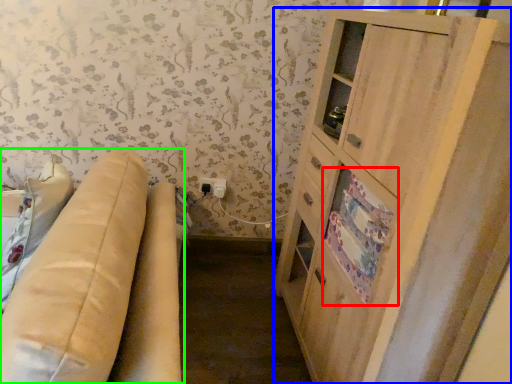
Question: Estimate the real-world distances between objects in this image. Which object is farther from drawer (highlighted by a red box), cabinetry (highlighted by a blue box) or studio couch (highlighted by a green box)?

Choices:
 (A) cabinetry
 (B) studio couch

Answer: (B)